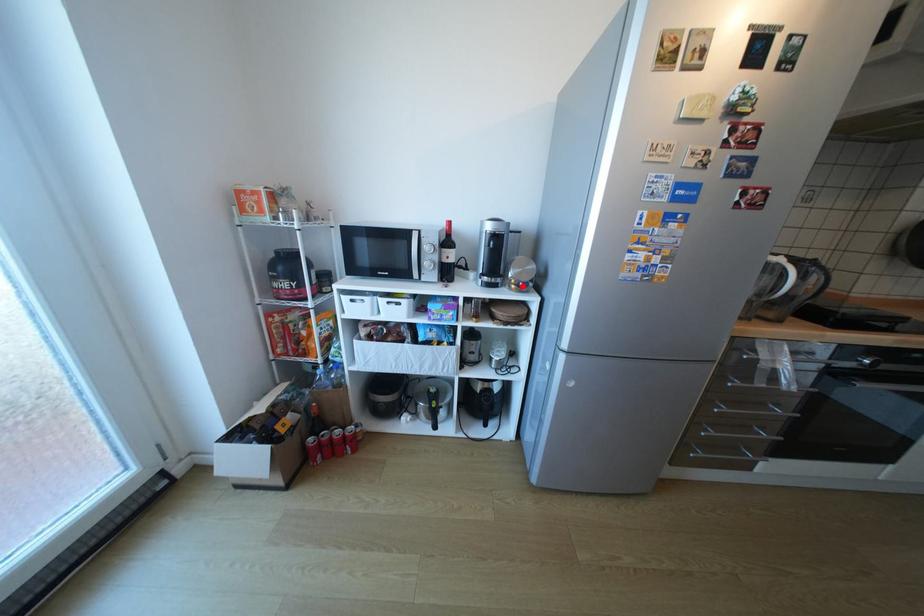
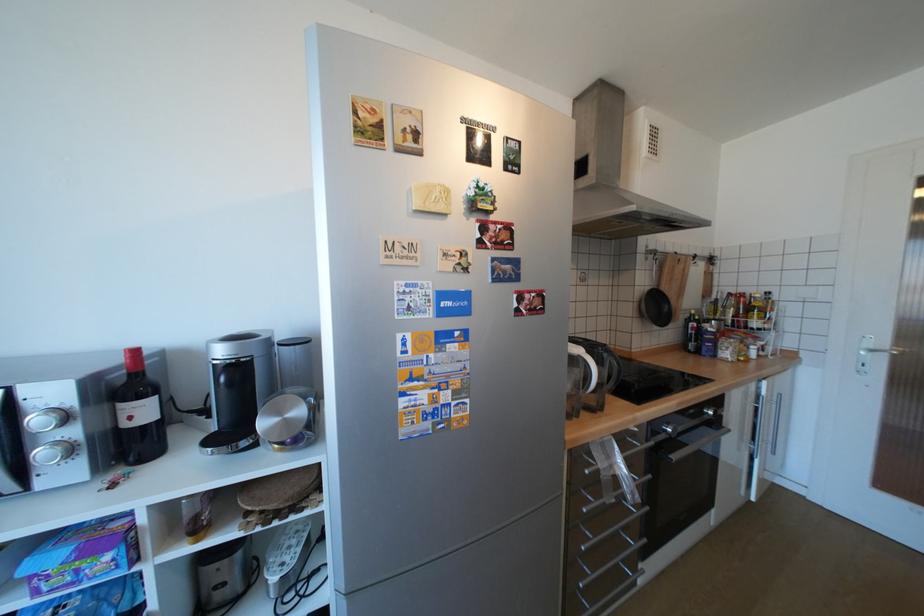
Locate, in the second image, the point that corresponds to the highlighted location in the first image.

(286, 446)